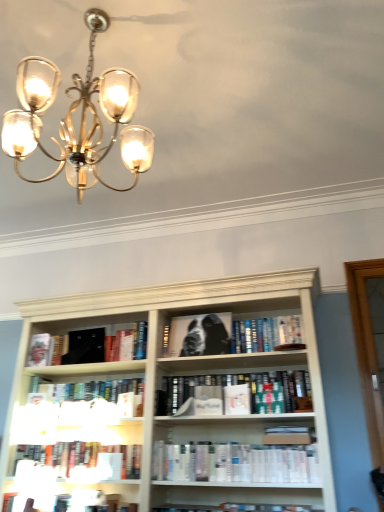
In order to click on vacant point above white matte book at center, which is the fifth book in bottom-to-top order (from a real-world perspective) in this screenshot , I will do `click(92, 371)`.